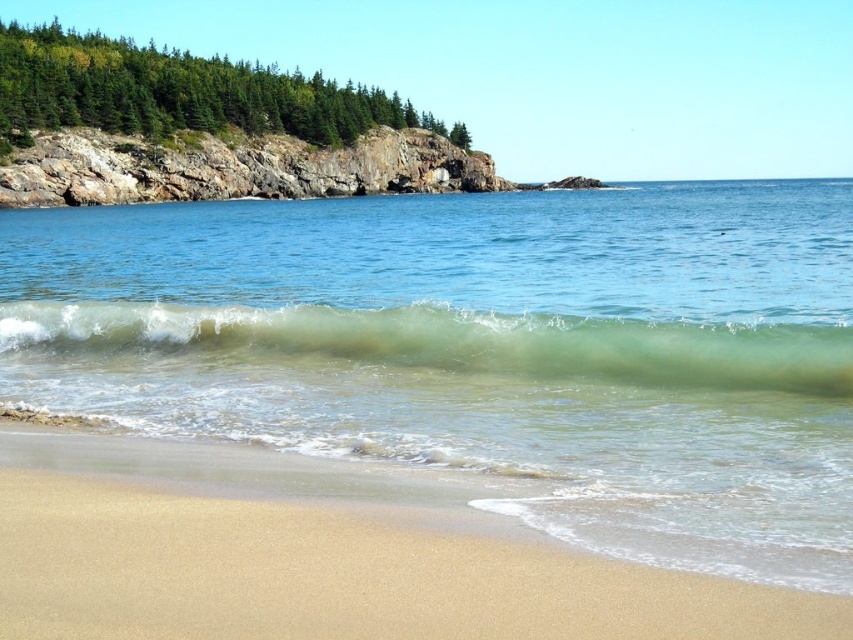
Can you confirm if clear water at center is positioned above sandy beach at lower left?

Correct, clear water at center is located above sandy beach at lower left.

Which is behind, point (227, 282) or point (438, 628)?

Positioned behind is point (227, 282).

Which is in front, point (711, 504) or point (67, 432)?

Point (711, 504)

Find the location of `clear water at center`. clear water at center is located at coordinates (483, 349).

Can you confirm if clear water at center is wider than green translucent wave at center?

Correct, the width of clear water at center exceeds that of green translucent wave at center.

Between point (534, 342) and point (567, 337), which one is positioned in front?

Point (567, 337)

Image resolution: width=853 pixels, height=640 pixels. Find the location of `clear water at center`. clear water at center is located at coordinates (483, 349).

Can you confirm if sandy beach at lower left is wider than green translucent wave at center?

No.

Consider the image. Is sandy beach at lower left behind green translucent wave at center?

No.

Measure the distance between point (316, 588) and camera.

The distance of point (316, 588) from camera is 21.33 feet.

This screenshot has height=640, width=853. I want to click on sandy beach at lower left, so click(320, 556).